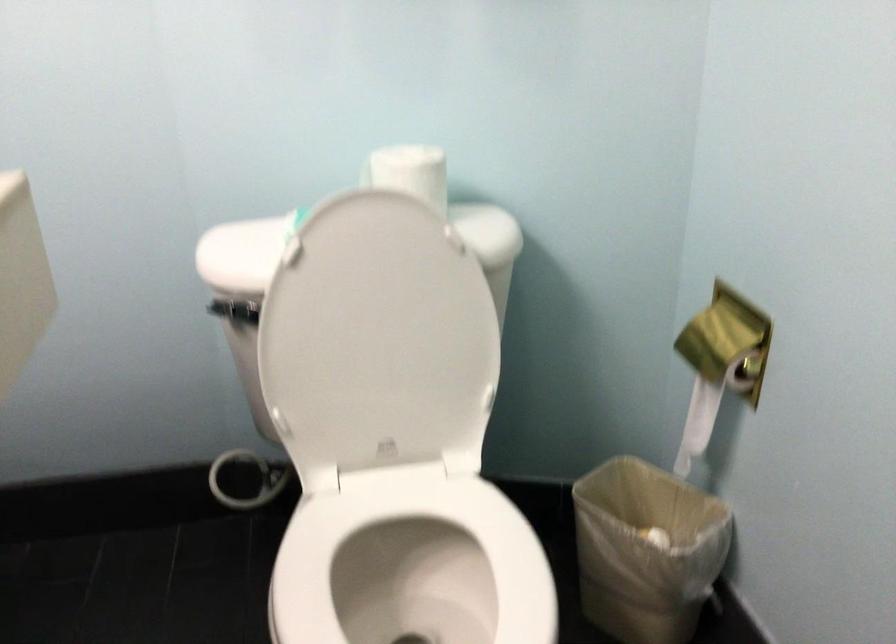
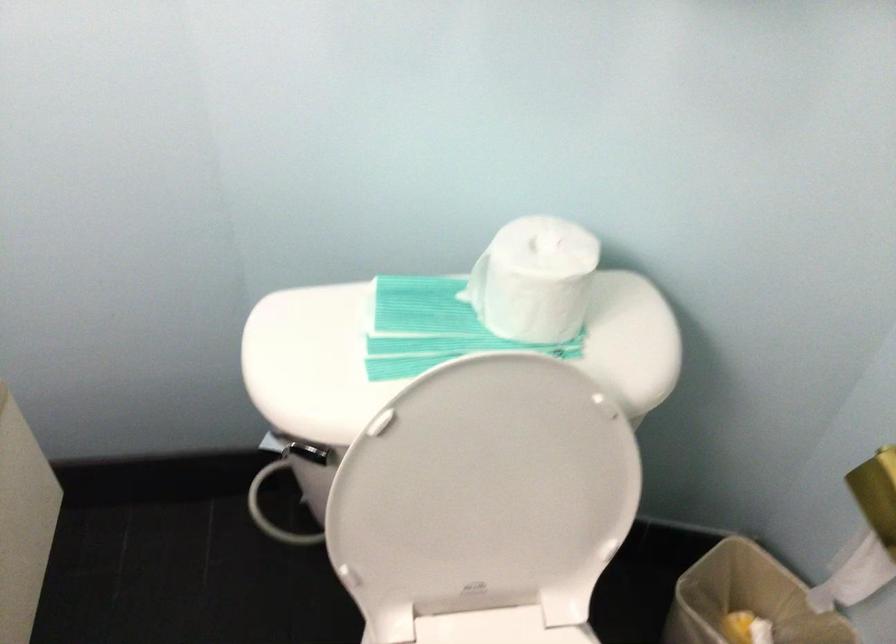
Question: The first image is from the beginning of the video and the second image is from the end. How did the camera likely rotate when shooting the video?

Choices:
 (A) Left
 (B) Right
 (C) Up
 (D) Down

Answer: (D)